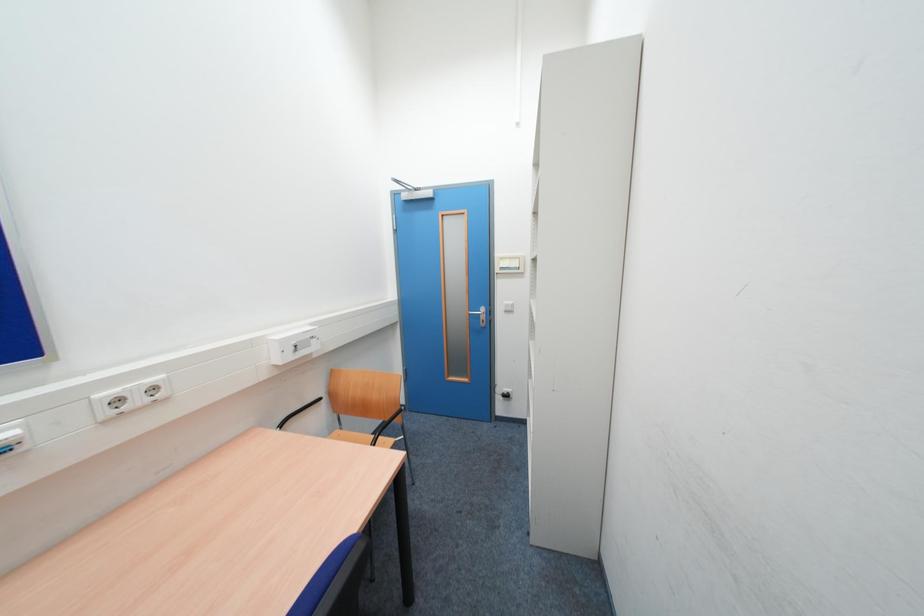
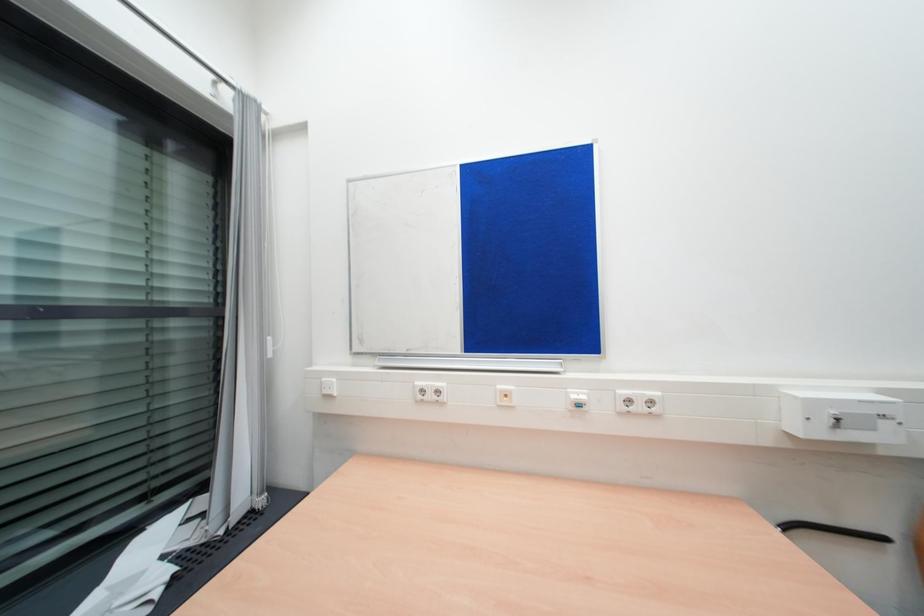
Question: Based on the continuous images, in which direction is the camera rotating? Reply with the corresponding letter.

Choices:
 (A) Left
 (B) Right
 (C) Up
 (D) Down

Answer: (A)